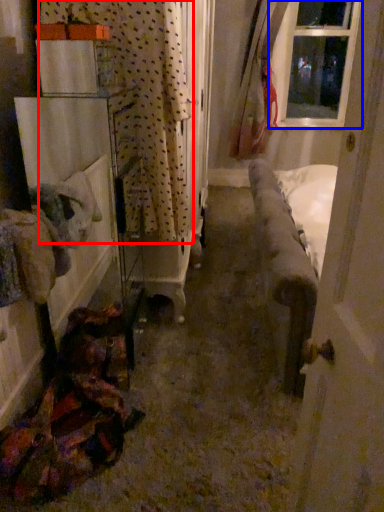
Question: Among these objects, which one is farthest to the camera, curtain (highlighted by a red box) or window (highlighted by a blue box)?

Choices:
 (A) curtain
 (B) window

Answer: (B)